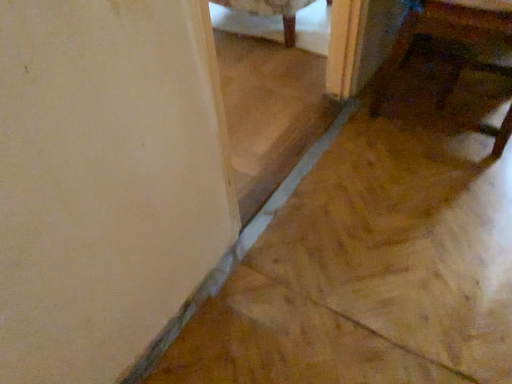
Where is `wooden table at lower right`? wooden table at lower right is located at coordinates (445, 45).

Describe the element at coordinates (445, 45) in the screenshot. I see `wooden table at lower right` at that location.

The width and height of the screenshot is (512, 384). Find the location of `wooden table at lower right`. wooden table at lower right is located at coordinates (445, 45).